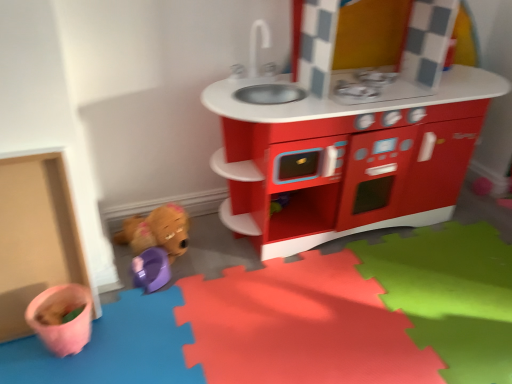
At what (x,y) coordinates should I click in order to perform the action: click on free space in front of brown plush toy at lower left, arranged as the second toy when ordered from the bottom. Please return your answer as a coordinate pair (x, y). The image size is (512, 384). Looking at the image, I should click on (160, 300).